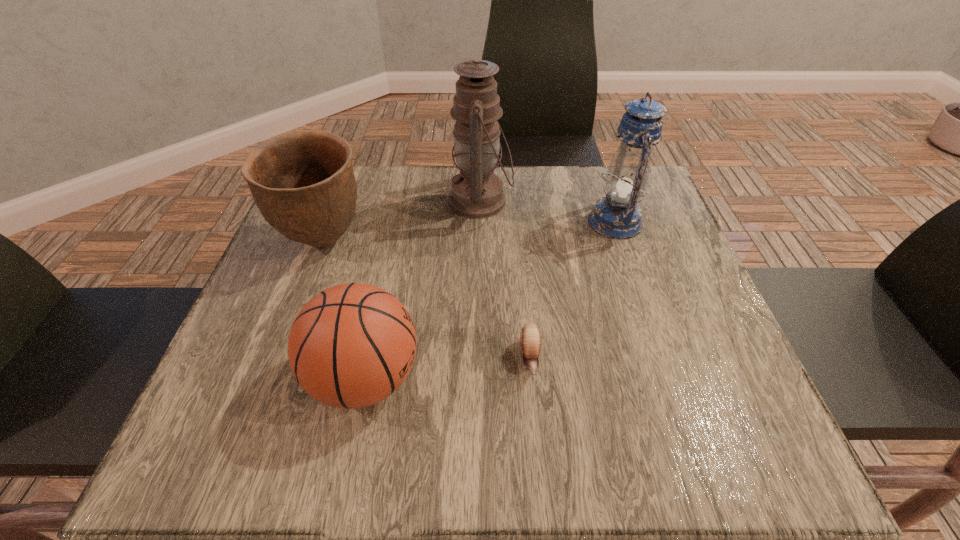
I want to click on object that is positioned at the near left corner, so click(352, 345).

Identify the location of object that is positioned at the far right corner. The image size is (960, 540). (617, 216).

You are a GUI agent. You are given a task and a screenshot of the screen. Output one action in this format:
    pyautogui.click(x=<x>, y=<y>)
    Task: Click on the vacant region at the far edge
    
    Given the screenshot: What is the action you would take?
    pyautogui.click(x=550, y=166)

In order to click on vacant space at the near edge of the desktop in this screenshot , I will do click(350, 428).

Image resolution: width=960 pixels, height=540 pixels. What are the coordinates of `vacant space at the left edge of the desktop` in the screenshot? It's located at (225, 384).

The image size is (960, 540). Identify the location of blank space at the right edge of the desktop. (665, 301).

In the image, there is a desktop. Find the location of `vacant space at the near left corner`. vacant space at the near left corner is located at coordinates (244, 446).

The height and width of the screenshot is (540, 960). What are the coordinates of `free space at the near right corner of the desktop` in the screenshot? It's located at (714, 463).

I want to click on vacant region between the oil lamp and the pottery, so click(x=402, y=221).

The height and width of the screenshot is (540, 960). I want to click on empty location between the lantern and the shortest object, so click(x=572, y=290).